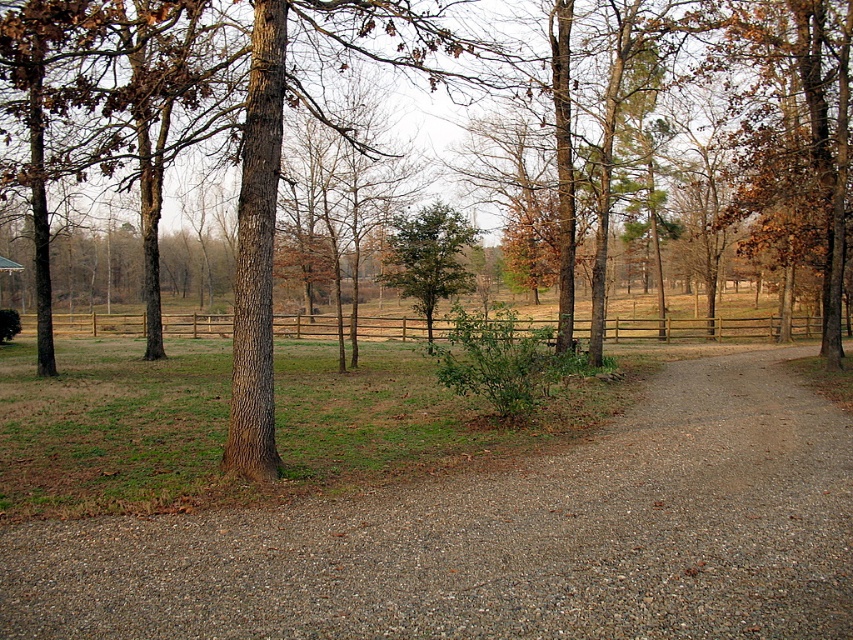
You are a hiker standing at the start of the brown gravel path at center and want to reach the green leafy tree at center. Which direction should you walk to get there?

The green leafy tree at center is taller than the brown gravel path at center, so you should walk forward along the brown gravel path at center towards the tree.

You are a gardener who needs to water the green leafy tree at center and the brown wooden fence at center. You have a hose that can reach 10 meters. Can you water both without moving the hose? Explain your reasoning.

The brown wooden fence at center is 10.30 meters from the green leafy tree at center. Since the hose can only reach 10 meters, you cannot water both without moving the hose because the distance between them exceeds the hose length.